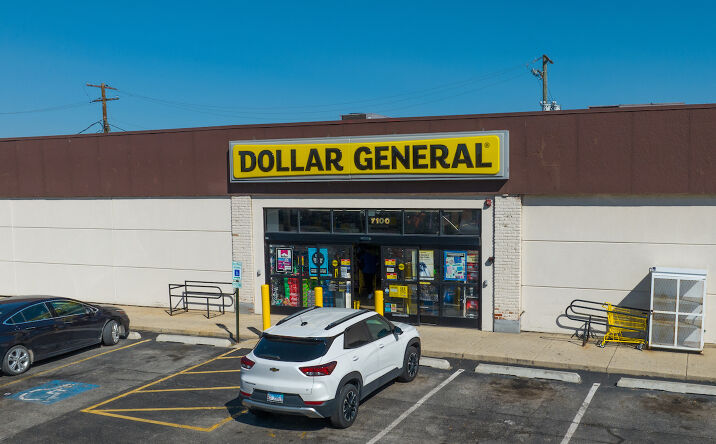
Where is `wires`? The width and height of the screenshot is (716, 444). wires is located at coordinates (34, 108), (217, 107), (233, 111), (251, 118).